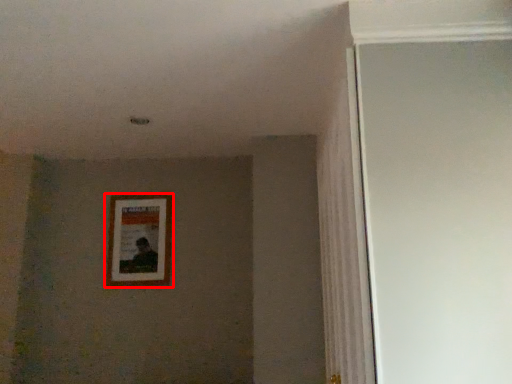
Question: From the image's perspective, what is the correct spatial relationship of picture frame (annotated by the red box) in relation to glass door?

Choices:
 (A) above
 (B) below

Answer: (B)